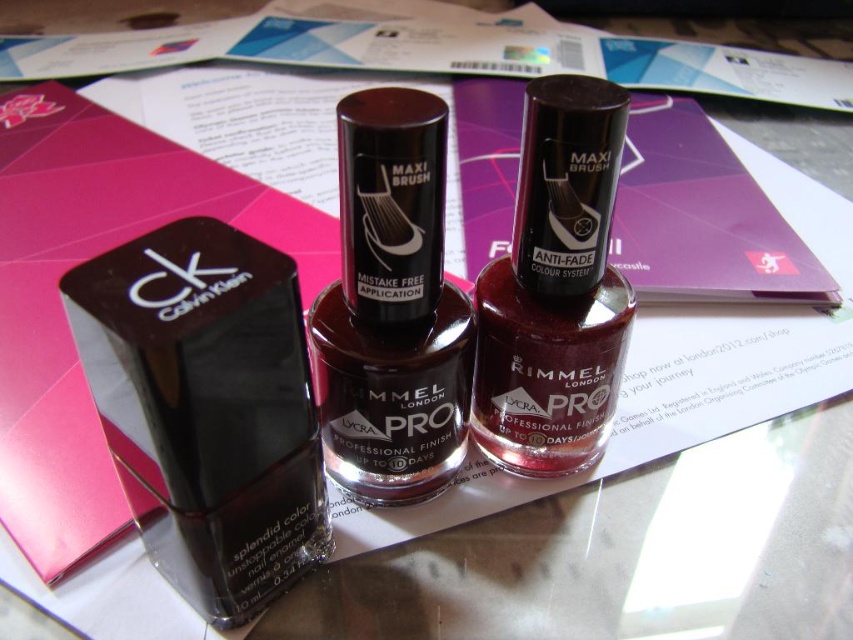
Question: Is matte black nail polish at left behind satin burgundy nail polish at center?

Choices:
 (A) yes
 (B) no

Answer: (B)

Question: Does matte black nail polish at left appear on the right side of satin burgundy nail polish at center?

Choices:
 (A) yes
 (B) no

Answer: (B)

Question: Which object is positioned closest to the shiny burgundy nail polish at center?

Choices:
 (A) matte black nail polish at left
 (B) satin burgundy nail polish at center

Answer: (B)

Question: Which object appears closest to the camera in this image?

Choices:
 (A) matte black nail polish at left
 (B) shiny burgundy nail polish at center
 (C) satin burgundy nail polish at center

Answer: (A)

Question: Considering the relative positions of matte black nail polish at left and shiny burgundy nail polish at center in the image provided, where is matte black nail polish at left located with respect to shiny burgundy nail polish at center?

Choices:
 (A) below
 (B) above

Answer: (A)

Question: Among these objects, which one is nearest to the camera?

Choices:
 (A) matte black nail polish at left
 (B) satin burgundy nail polish at center

Answer: (A)